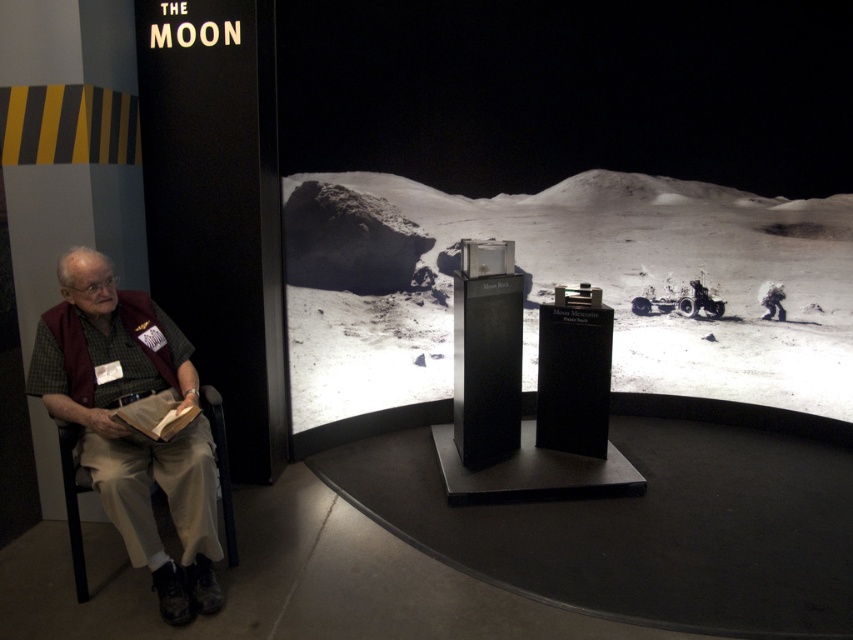
Question: Does beige fabric pants at left have a larger size compared to brown paper book at lower left?

Choices:
 (A) yes
 (B) no

Answer: (A)

Question: Which point appears farthest from the camera in this image?

Choices:
 (A) (149, 436)
 (B) (91, 259)

Answer: (B)

Question: From the image, what is the correct spatial relationship of beige fabric pants at left in relation to brown paper book at lower left?

Choices:
 (A) below
 (B) above

Answer: (A)

Question: Among these points, which one is farthest from the camera?

Choices:
 (A) (173, 396)
 (B) (161, 420)

Answer: (A)

Question: Does beige fabric pants at left come in front of brown paper book at lower left?

Choices:
 (A) no
 (B) yes

Answer: (B)